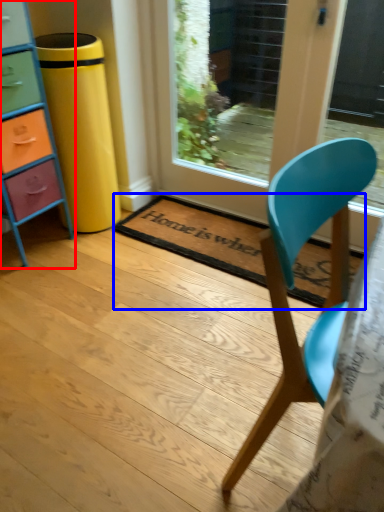
Question: Which of the following is the closest to the observer, chest of drawers (highlighted by a red box) or mat (highlighted by a blue box)?

Choices:
 (A) chest of drawers
 (B) mat

Answer: (A)